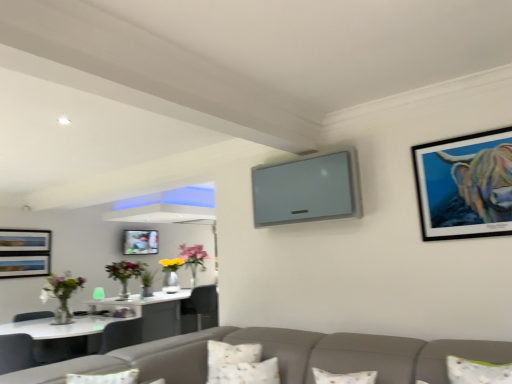
Question: Considering the positions of point (477, 216) and point (240, 375), is point (477, 216) closer or farther from the camera than point (240, 375)?

Choices:
 (A) farther
 (B) closer

Answer: (B)

Question: Is metallic black frame at upper right, which is the first picture frame from right to left, spatially inside white textured pillow at lower center, acting as the second pillow starting from the back, or outside of it?

Choices:
 (A) outside
 (B) inside

Answer: (A)

Question: Which is nearer to the white textured pillow at lower center, the 1th pillow positioned from the back?

Choices:
 (A) metallic silver picture frame at center, the first picture frame positioned from the back
 (B) metallic black frame at upper right, the second picture frame in the left-to-right sequence
 (C) white textured pillow at lower center, positioned as the 1th pillow in front-to-back order
 (D) translucent glass vase with flowers at left, the second floral arrangement when ordered from right to left
 (E) translucent glass vase at center, arranged as the 1th floral arrangement when viewed from the back

Answer: (C)

Question: Estimate the real-world distances between objects in this image. Which object is closer to the translucent glass vase with flowers at left, which ranks as the first floral arrangement in front-to-back order?

Choices:
 (A) white textured pillow at lower center, the 2th pillow in the front-to-back sequence
 (B) metallic black frame at upper right, the second picture frame in the left-to-right sequence
 (C) translucent glass vase at center, placed as the 1th floral arrangement when sorted from right to left
 (D) white textured pillow at lower center, positioned as the 1th pillow in front-to-back order
 (E) metallic silver picture frame at center, placed as the second picture frame when sorted from top to bottom

Answer: (E)